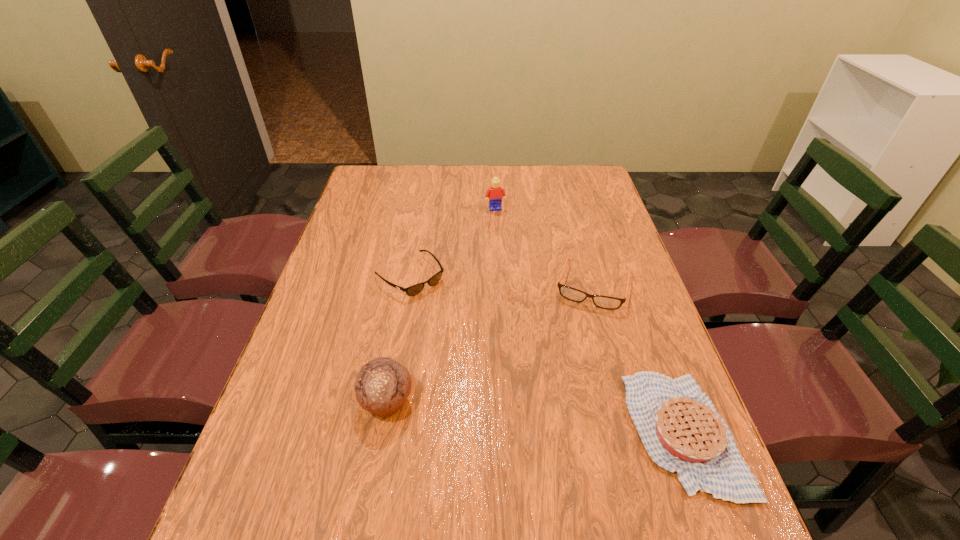
The width and height of the screenshot is (960, 540). Find the location of `vacant space positioned 0.320m on the front-facing side of the spectacles`. vacant space positioned 0.320m on the front-facing side of the spectacles is located at coordinates (559, 413).

Identify the location of free region located 0.340m on the front-facing side of the sunglasses. (516, 374).

Where is `vacant region located on the front-facing side of the sunglasses`? This screenshot has width=960, height=540. vacant region located on the front-facing side of the sunglasses is located at coordinates pos(534,391).

Locate an element on the screen. The height and width of the screenshot is (540, 960). vacant region located 0.370m on the front-facing side of the sunglasses is located at coordinates (524, 382).

You are a GUI agent. You are given a task and a screenshot of the screen. Output one action in this format:
    pyautogui.click(x=<x>, y=<y>)
    Task: Click on the vacant area located on the front-facing side of the farthest object
    
    Given the screenshot: What is the action you would take?
    pyautogui.click(x=502, y=231)

Find the location of a particular element. vacant space situated 0.250m on the front-facing side of the farthest object is located at coordinates (509, 258).

Find the location of a particular element. Image resolution: width=960 pixels, height=540 pixels. free point located on the front-facing side of the farthest object is located at coordinates (516, 282).

Where is `object situated at the near edge`? The width and height of the screenshot is (960, 540). object situated at the near edge is located at coordinates (679, 426).

Locate an element on the screen. This screenshot has width=960, height=540. object that is at the left edge is located at coordinates (413, 290).

The image size is (960, 540). What are the coordinates of `pie at the right edge` in the screenshot? It's located at (679, 426).